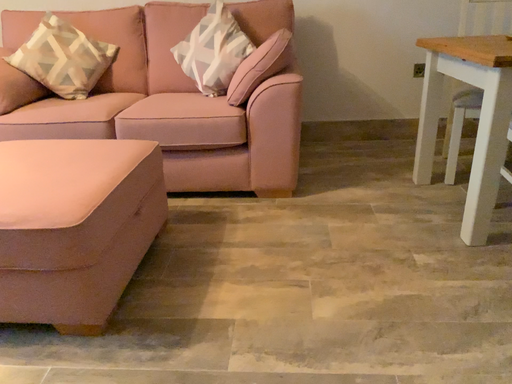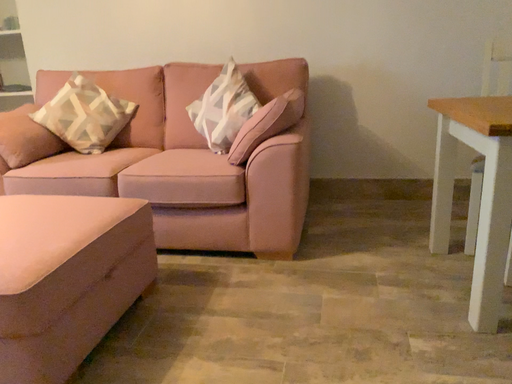
Question: Which way did the camera rotate in the video?

Choices:
 (A) rotated downward
 (B) rotated upward

Answer: (B)